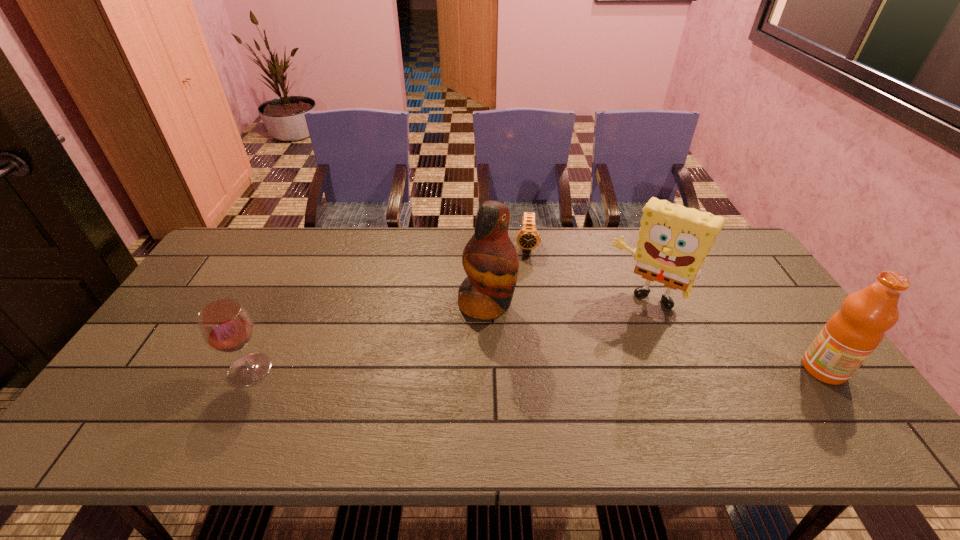
Where is `vacant space on the desktop that is between the leftmost object and the fruit juice and is positioned on the face of the tallest object`? This screenshot has height=540, width=960. vacant space on the desktop that is between the leftmost object and the fruit juice and is positioned on the face of the tallest object is located at coordinates (607, 369).

Find the location of a particular element. vacant spot on the desktop that is between the leftmost object and the rightmost object and is positioned on the face of the third object from left to right is located at coordinates (524, 369).

At what (x,y) coordinates should I click in order to perform the action: click on vacant space on the desktop that is between the leftmost object and the rightmost object and is positioned on the face of the fourth object from left to right. Please return your answer as a coordinate pair (x, y). The width and height of the screenshot is (960, 540). Looking at the image, I should click on (607, 369).